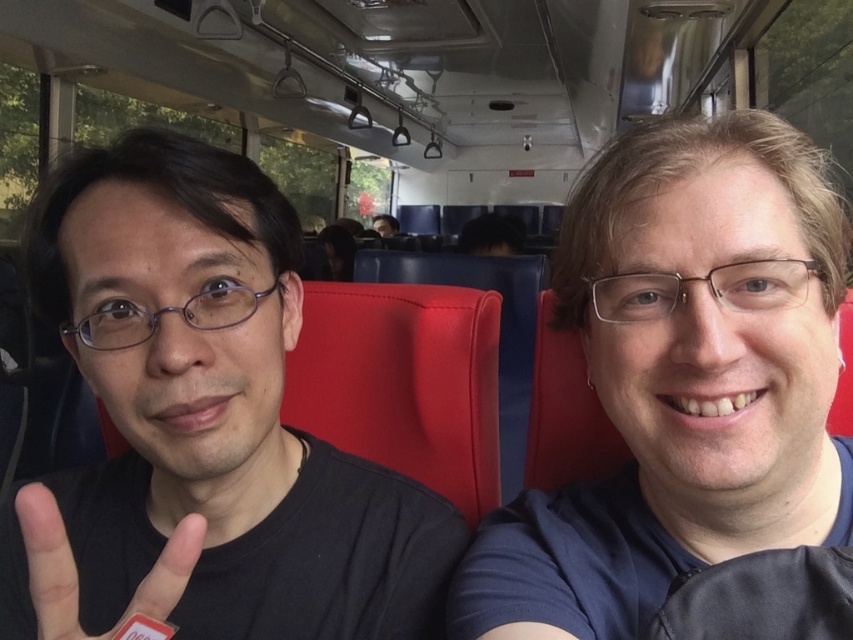
Who is higher up, black matte shirt at left or blue fabric shirt at right?

Positioned higher is blue fabric shirt at right.

Is point (62, 273) closer to camera compared to point (741, 202)?

No, it is not.

Is point (146, 145) positioned before point (650, 285)?

No, it is behind (650, 285).

At what (x,y) coordinates should I click in order to perform the action: click on black matte shirt at left. Please return your answer as a coordinate pair (x, y). This screenshot has width=853, height=640. Looking at the image, I should click on (202, 420).

Can you confirm if black matte shirt at left is positioned below dark brown hair at upper center?

Correct, black matte shirt at left is located below dark brown hair at upper center.

Between black matte shirt at left and dark brown hair at upper center, which one appears on the left side from the viewer's perspective?

dark brown hair at upper center

Find the location of `black matte shirt at left`. black matte shirt at left is located at coordinates (202, 420).

Describe the element at coordinates (682, 380) in the screenshot. The image size is (853, 640). I see `blue fabric shirt at right` at that location.

Who is higher up, blue fabric shirt at right or black matte hand at left?

blue fabric shirt at right

You are a GUI agent. You are given a task and a screenshot of the screen. Output one action in this format:
    pyautogui.click(x=<x>, y=<y>)
    Task: Click on the blue fabric shirt at right
    The height and width of the screenshot is (640, 853).
    Given the screenshot: What is the action you would take?
    pyautogui.click(x=682, y=380)